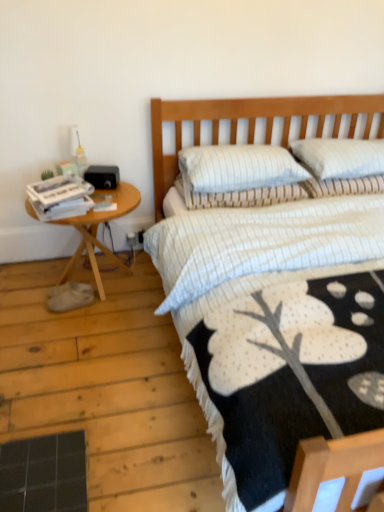
Question: Considering the relative sizes of white paper magazines at left and white striped pillow at upper right, which appears as the 3th pillow when viewed from the left, in the image provided, is white paper magazines at left smaller than white striped pillow at upper right, which appears as the 3th pillow when viewed from the left,?

Choices:
 (A) no
 (B) yes

Answer: (B)

Question: From the image's perspective, does white paper magazines at left appear lower than white striped pillow at upper right, which is the first pillow in right-to-left order?

Choices:
 (A) no
 (B) yes

Answer: (B)

Question: Does white paper magazines at left come in front of white striped pillow at upper right, which is the first pillow in right-to-left order?

Choices:
 (A) yes
 (B) no

Answer: (A)

Question: Is white paper magazines at left in contact with white striped pillow at upper right, which appears as the 3th pillow when viewed from the left?

Choices:
 (A) no
 (B) yes

Answer: (A)

Question: Can you confirm if white paper magazines at left is taller than white striped pillow at upper right, which appears as the 3th pillow when viewed from the left?

Choices:
 (A) yes
 (B) no

Answer: (B)

Question: From a real-world perspective, is white striped pillow at upper right, which appears as the 3th pillow when viewed from the left, physically located above or below woodenwoodenside table at left?

Choices:
 (A) below
 (B) above

Answer: (B)

Question: Considering the positions of white striped pillow at upper right, which is the first pillow in right-to-left order, and woodenwoodenside table at left in the image, is white striped pillow at upper right, which is the first pillow in right-to-left order, wider or thinner than woodenwoodenside table at left?

Choices:
 (A) thin
 (B) wide

Answer: (A)

Question: From the image's perspective, is white striped pillow at upper right, which is the first pillow in right-to-left order, located above or below woodenwoodenside table at left?

Choices:
 (A) below
 (B) above

Answer: (B)

Question: Considering the positions of white striped pillow at upper right, which appears as the 3th pillow when viewed from the left, and woodenwoodenside table at left in the image, is white striped pillow at upper right, which appears as the 3th pillow when viewed from the left, bigger or smaller than woodenwoodenside table at left?

Choices:
 (A) big
 (B) small

Answer: (B)

Question: From a real-world perspective, is white striped pillow at center, acting as the 2th pillow starting from the right, physically located above or below white striped pillow at upper right, which is the first pillow in right-to-left order?

Choices:
 (A) below
 (B) above

Answer: (A)

Question: Considering the positions of white striped pillow at center, acting as the 2th pillow starting from the right, and white striped pillow at upper right, which appears as the 3th pillow when viewed from the left, in the image, is white striped pillow at center, acting as the 2th pillow starting from the right, taller or shorter than white striped pillow at upper right, which appears as the 3th pillow when viewed from the left,?

Choices:
 (A) short
 (B) tall

Answer: (B)

Question: Looking at their shapes, would you say white striped pillow at center, which is counted as the 2th pillow, starting from the left, is wider or thinner than white striped pillow at upper right, which appears as the 3th pillow when viewed from the left?

Choices:
 (A) thin
 (B) wide

Answer: (B)

Question: In the image, is white striped pillow at center, which is counted as the 2th pillow, starting from the left, positioned in front of or behind white striped pillow at upper right, which appears as the 3th pillow when viewed from the left?

Choices:
 (A) front
 (B) behind

Answer: (A)

Question: Would you say white striped pillow at upper right, which appears as the 3th pillow when viewed from the left, is to the left or to the right of white paper magazines at left in the picture?

Choices:
 (A) right
 (B) left

Answer: (A)

Question: Do you think white striped pillow at upper right, which is the first pillow in right-to-left order, is within white paper magazines at left, or outside of it?

Choices:
 (A) outside
 (B) inside

Answer: (A)